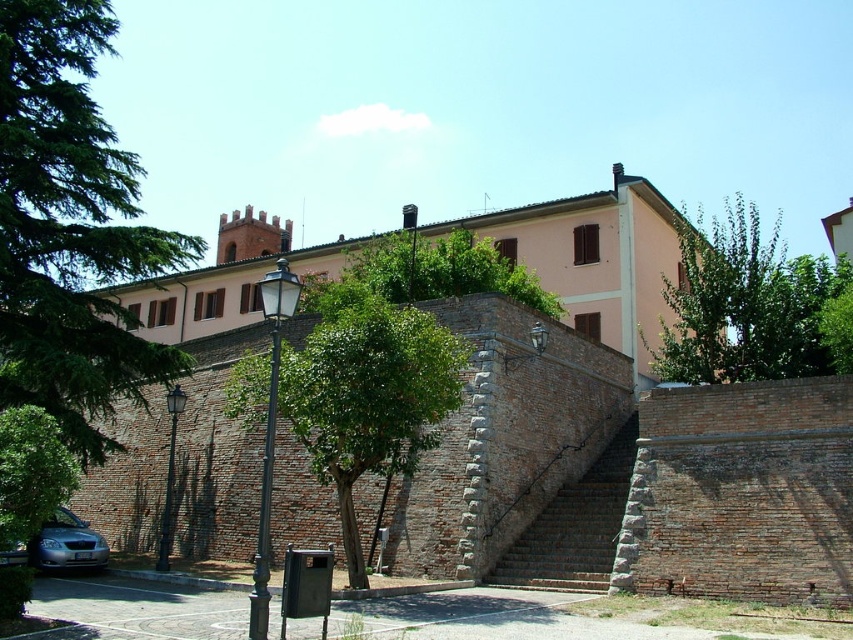
Question: Does green leafy tree at center have a larger size compared to green leafy tree at upper center?

Choices:
 (A) no
 (B) yes

Answer: (B)

Question: Does green leafy tree at left have a larger size compared to green leafy tree at lower left?

Choices:
 (A) no
 (B) yes

Answer: (B)

Question: Which point is farther to the camera?

Choices:
 (A) silver metallic car at lower left
 (B) green leafy tree at upper center
 (C) brick stairs at center
 (D) green leafy tree at lower left

Answer: (B)

Question: Which object appears farthest from the camera in this image?

Choices:
 (A) green leafy tree at left
 (B) green leafy tree at upper center
 (C) brick stairs at center
 (D) silver metallic car at lower left

Answer: (B)

Question: Can you confirm if green leafy tree at center is positioned to the left of brick stairs at center?

Choices:
 (A) yes
 (B) no

Answer: (A)

Question: Which of these objects is positioned farthest from the silver metallic car at lower left?

Choices:
 (A) brick stairs at center
 (B) green leafy tree at upper right
 (C) green leafy tree at left
 (D) green leafy tree at upper center

Answer: (B)